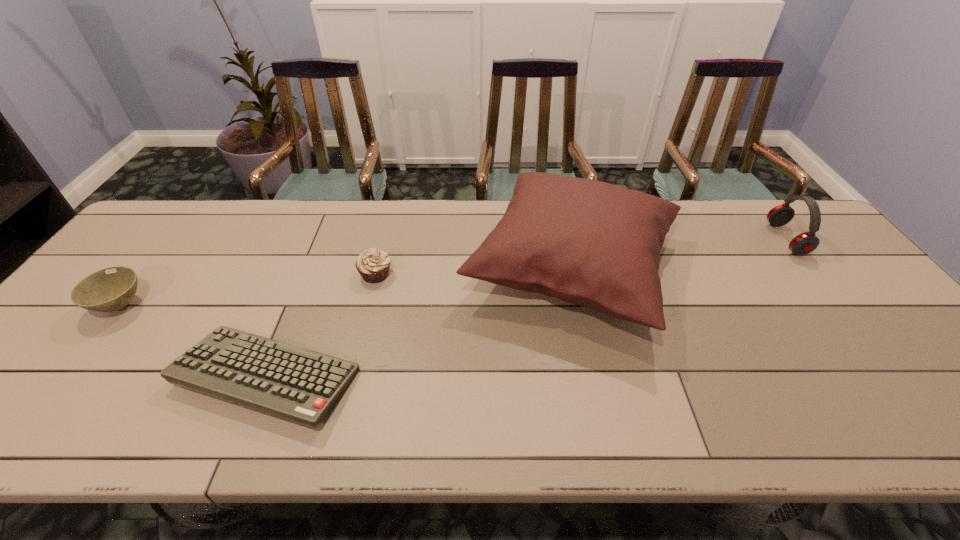
This screenshot has width=960, height=540. I want to click on blank area located on the ear cups of the earphone, so click(656, 239).

Identify the location of free point located 0.280m on the back of the leftmost object. (185, 224).

The width and height of the screenshot is (960, 540). Identify the location of blank area located 0.190m on the back of the muffin. (388, 222).

I want to click on vacant area situated on the right of the computer keyboard, so click(x=390, y=377).

The height and width of the screenshot is (540, 960). In order to click on cushion present at the far edge in this screenshot , I will do `click(594, 244)`.

The image size is (960, 540). I want to click on earphone that is at the far edge, so click(x=804, y=243).

Locate an element on the screen. The height and width of the screenshot is (540, 960). object present at the near edge is located at coordinates (300, 385).

Locate an element on the screen. This screenshot has width=960, height=540. object located at the left edge is located at coordinates (110, 289).

Find the location of `object that is at the right edge`. object that is at the right edge is located at coordinates (804, 243).

Locate an element on the screen. This screenshot has width=960, height=540. object situated at the far right corner is located at coordinates (804, 243).